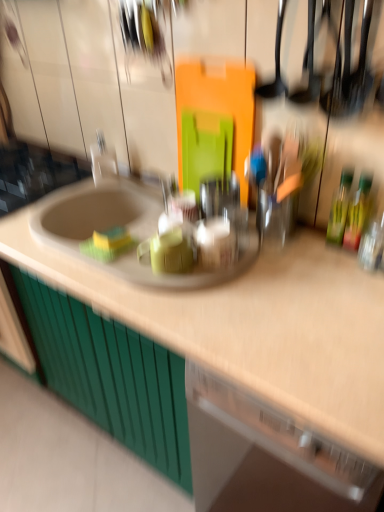
Image resolution: width=384 pixels, height=512 pixels. In order to click on blank space situated above green matte cabinet at lower left (from a real-world perspective) in this screenshot , I will do `click(58, 455)`.